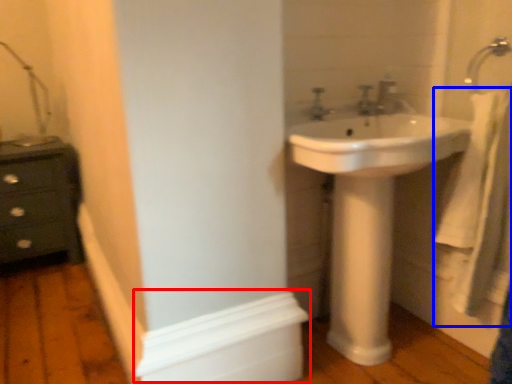
Question: Which object appears closest to the camera in this image, molding (highlighted by a red box) or bath towel (highlighted by a blue box)?

Choices:
 (A) molding
 (B) bath towel

Answer: (A)